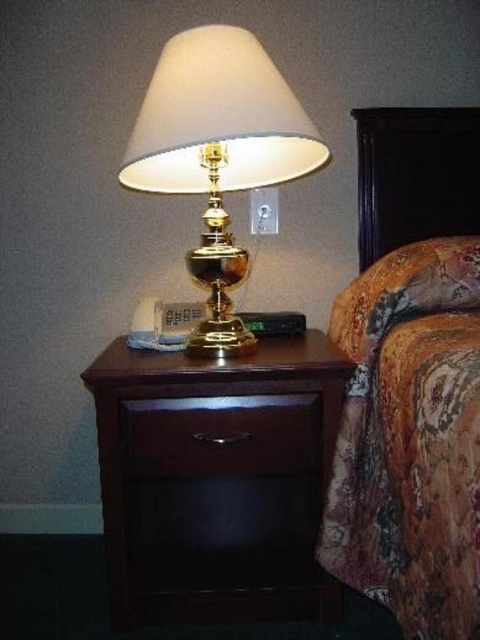
Does floral fabric bed at right have a greater height compared to floral fabric pillow at right?

Yes, floral fabric bed at right is taller than floral fabric pillow at right.

Which is below, floral fabric bed at right or floral fabric pillow at right?

floral fabric bed at right is below.

Where is `floral fabric bed at right`? The height and width of the screenshot is (640, 480). floral fabric bed at right is located at coordinates (411, 376).

Locate an element on the screen. The height and width of the screenshot is (640, 480). floral fabric bed at right is located at coordinates (411, 376).

Is gold polished table lamp at upper center wider than dark wood drawer at center?

Indeed, gold polished table lamp at upper center has a greater width compared to dark wood drawer at center.

Who is more distant from viewer, (x=176, y=140) or (x=184, y=444)?

The point (x=184, y=444) is more distant.

Does point (193, 74) come in front of point (123, 422)?

Yes, it is.

Find the location of a particular element. gold polished table lamp at upper center is located at coordinates (218, 152).

Measure the distance between floral fabric bed at right and dark wood drawer at center.

They are 30.38 centimeters apart.

At what (x,y) coordinates should I click in order to perform the action: click on floral fabric bed at right. Please return your answer as a coordinate pair (x, y). The height and width of the screenshot is (640, 480). Looking at the image, I should click on (x=411, y=376).

Between point (441, 438) and point (235, 397), which one is positioned in front?

Point (441, 438)

Where is `floral fabric bed at right`? The image size is (480, 640). floral fabric bed at right is located at coordinates (411, 376).